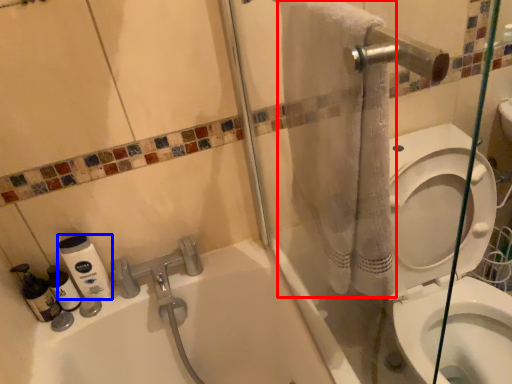
Question: Which object appears closest to the camera in this image, bath towel (highlighted by a red box) or cleaning product (highlighted by a blue box)?

Choices:
 (A) bath towel
 (B) cleaning product

Answer: (A)